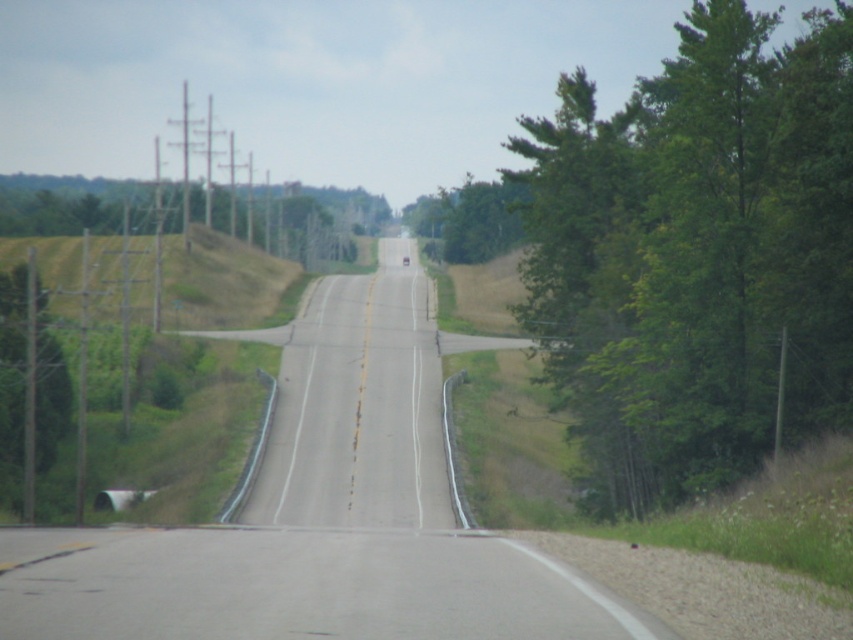
You are driving a car and see two points on the road ahead. The first is at point (630, 236) and the second is at point (277, 428). Which point will you reach first as you continue driving forward?

Point (630, 236) is in front of point (277, 428), so you will reach point (630, 236) first.

You are driving a car and see two green leafy trees along the road. The green leafy tree at left is on your left side, and the green leafy tree at right is on your right side. Which tree is closer to the center of the road?

The green leafy tree at right is positioned on the right side of green leafy tree at left, so the green leafy tree at left is closer to the center of the road.

You are standing at the center of the road and looking towards the distant bend. There is a point marked at coordinates (695,253). What object does this point correspond to in the scene?

The point corresponds to the green leafy tree at right.